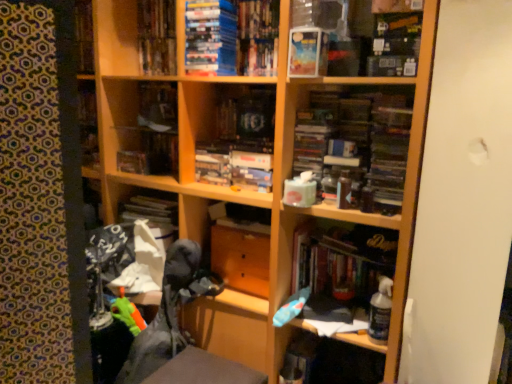
Question: Which direction should I rotate to look at hardcover books at upper center, marked as the first book in a top-to-bottom arrangement?

Choices:
 (A) right
 (B) left

Answer: (B)

Question: Does hardcover books at upper center, marked as the first book in a top-to-bottom arrangement, have a lesser width compared to matte plastic paperback book at upper center?

Choices:
 (A) no
 (B) yes

Answer: (B)

Question: Does hardcover books at upper center, marked as the first book in a top-to-bottom arrangement, come behind matte plastic paperback book at upper center?

Choices:
 (A) yes
 (B) no

Answer: (A)

Question: Does hardcover books at upper center, placed as the fourth book when sorted from bottom to top, have a smaller size compared to matte plastic paperback book at upper center?

Choices:
 (A) yes
 (B) no

Answer: (B)

Question: From a real-world perspective, is hardcover books at upper center, the 2th book from the left, below matte plastic paperback book at upper center?

Choices:
 (A) no
 (B) yes

Answer: (A)

Question: From the image's perspective, is hardcover books at upper center, placed as the fourth book when sorted from bottom to top, beneath matte plastic paperback book at upper center?

Choices:
 (A) no
 (B) yes

Answer: (A)

Question: Can we say hardcover books at upper center, marked as the first book in a top-to-bottom arrangement, lies outside matte plastic paperback book at upper center?

Choices:
 (A) no
 (B) yes

Answer: (B)

Question: Does hardcover book at center, the fourth book from the left, have a greater height compared to matte plastic book at center, acting as the 4th book starting from the right?

Choices:
 (A) no
 (B) yes

Answer: (B)

Question: Can you confirm if hardcover book at center, the fourth book from the left, is thinner than matte plastic book at center, arranged as the 3th book when viewed from the top?

Choices:
 (A) no
 (B) yes

Answer: (A)

Question: Can you confirm if hardcover book at center, the fourth book from the left, is bigger than matte plastic book at center, acting as the 4th book starting from the right?

Choices:
 (A) no
 (B) yes

Answer: (B)

Question: Can you confirm if hardcover book at center, which is the 1th book in bottom-to-top order, is wider than matte plastic book at center, which ranks as the 2th book in bottom-to-top order?

Choices:
 (A) yes
 (B) no

Answer: (A)

Question: Is hardcover book at center, which is the 1th book in bottom-to-top order, far from matte plastic book at center, arranged as the 3th book when viewed from the top?

Choices:
 (A) yes
 (B) no

Answer: (B)

Question: Can you confirm if hardcover book at center, which appears as the fourth book when viewed from the top, is positioned to the left of matte plastic book at center, arranged as the 3th book when viewed from the top?

Choices:
 (A) no
 (B) yes

Answer: (A)

Question: Is matte plastic book at upper center, the 3th book viewed from the left, turned away from wooden drawer at center?

Choices:
 (A) yes
 (B) no

Answer: (B)